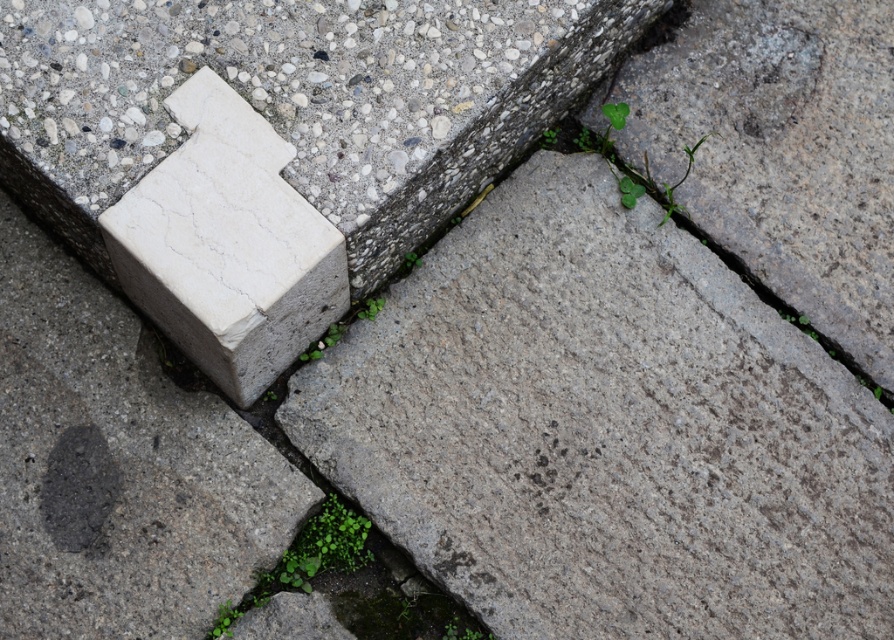
Does white marble block at upper left have a larger size compared to green leafy weed at lower center?

Correct, white marble block at upper left is larger in size than green leafy weed at lower center.

Who is higher up, white marble block at upper left or green leafy weed at lower center?

Positioned higher is white marble block at upper left.

Does point (235, 225) come behind point (254, 589)?

No, (235, 225) is in front of (254, 589).

You are a GUI agent. You are given a task and a screenshot of the screen. Output one action in this format:
    pyautogui.click(x=<x>, y=<y>)
    Task: Click on the white marble block at upper left
    This screenshot has height=640, width=894.
    Given the screenshot: What is the action you would take?
    pyautogui.click(x=226, y=244)

Can you confirm if white marble block at upper left is smaller than green leafy weed at center?

Incorrect, white marble block at upper left is not smaller in size than green leafy weed at center.

Image resolution: width=894 pixels, height=640 pixels. Describe the element at coordinates (226, 244) in the screenshot. I see `white marble block at upper left` at that location.

Who is more distant from viewer, (240, 164) or (365, 310)?

The point (365, 310) is more distant.

Identify the location of white marble block at upper left. Image resolution: width=894 pixels, height=640 pixels. (226, 244).

Which is in front, point (299, 556) or point (378, 298)?

Point (299, 556)

Between green leafy weed at lower center and green leafy weed at center, which one has more height?

Standing taller between the two is green leafy weed at lower center.

Which is in front, point (321, 636) or point (372, 320)?

Point (321, 636) is in front.

Identify the location of green leafy weed at lower center. (305, 560).